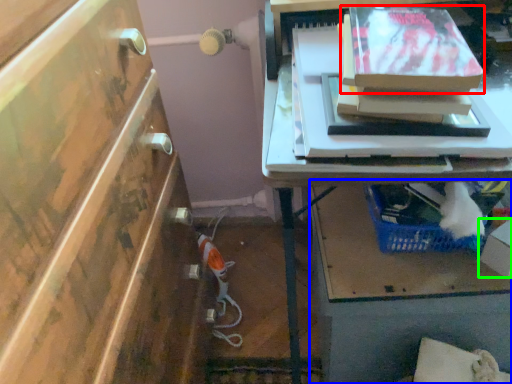
Question: Estimate the real-world distances between objects in this image. Which object is closer to storage box (highlighted by a red box), vanity (highlighted by a blue box) or box (highlighted by a green box)?

Choices:
 (A) vanity
 (B) box

Answer: (B)